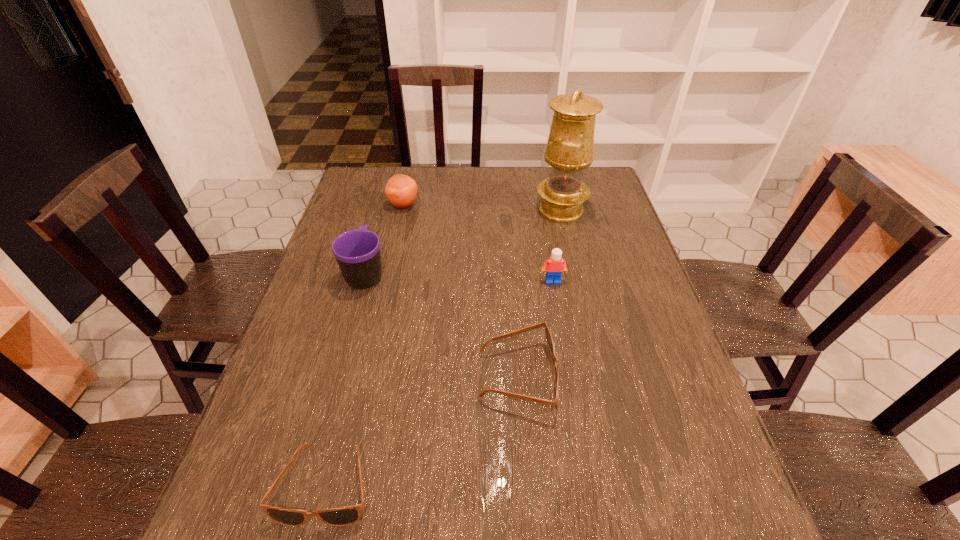
What are the coordinates of `mug located at the left edge` in the screenshot? It's located at (357, 252).

Image resolution: width=960 pixels, height=540 pixels. I want to click on object positioned at the right edge, so click(x=569, y=151).

Locate an element on the screen. This screenshot has width=960, height=540. object that is positioned at the far left corner is located at coordinates (401, 190).

Locate an element on the screen. object that is at the near left corner is located at coordinates (343, 516).

Identify the location of object that is at the far right corner. (569, 151).

The image size is (960, 540). I want to click on vacant area at the far edge of the desktop, so click(455, 166).

The image size is (960, 540). Find the location of `vacant region at the left edge of the desktop`. vacant region at the left edge of the desktop is located at coordinates (331, 260).

In the image, there is a desktop. Where is `vacant space at the right edge`? The height and width of the screenshot is (540, 960). vacant space at the right edge is located at coordinates (634, 417).

Where is `free space at the near right corner`? The image size is (960, 540). free space at the near right corner is located at coordinates (730, 483).

Find the location of `empty location between the orange and the mug`. empty location between the orange and the mug is located at coordinates (384, 239).